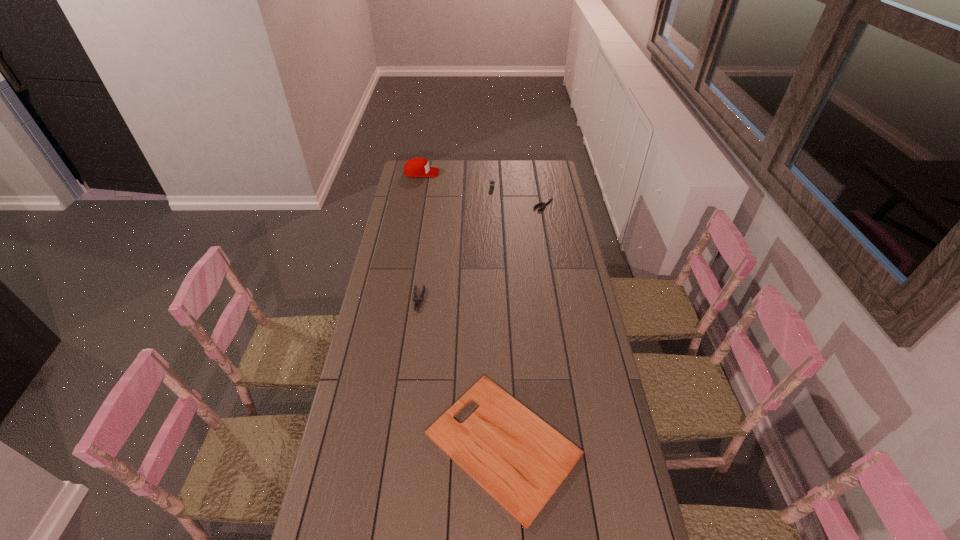
Where is `vacant space at the left edge`? The image size is (960, 540). vacant space at the left edge is located at coordinates (390, 234).

The image size is (960, 540). What are the coordinates of `vacant point at the right edge` in the screenshot? It's located at point(590,454).

The width and height of the screenshot is (960, 540). Identify the location of free space at the far right corner of the desktop. (530, 166).

In order to click on vacant area between the beer can and the third farthest object in this screenshot , I will do `click(517, 196)`.

The height and width of the screenshot is (540, 960). What are the coordinates of `vacant area that lies between the chopping board and the left pliers` in the screenshot? It's located at (461, 372).

Locate an element on the screen. Image resolution: width=960 pixels, height=540 pixels. unoccupied position between the nearest object and the baseball cap is located at coordinates (462, 308).

Image resolution: width=960 pixels, height=540 pixels. What are the coordinates of `vacant space in between the farthest object and the chopping board` in the screenshot? It's located at (462, 308).

Identify the location of blank region between the shorter pliers and the beer can. The height and width of the screenshot is (540, 960). (517, 196).

Where is `vacant area between the nearer pliers and the chopping board`? The height and width of the screenshot is (540, 960). vacant area between the nearer pliers and the chopping board is located at coordinates (461, 372).

The width and height of the screenshot is (960, 540). Identify the location of free space between the third nearest object and the nearest object. (523, 324).